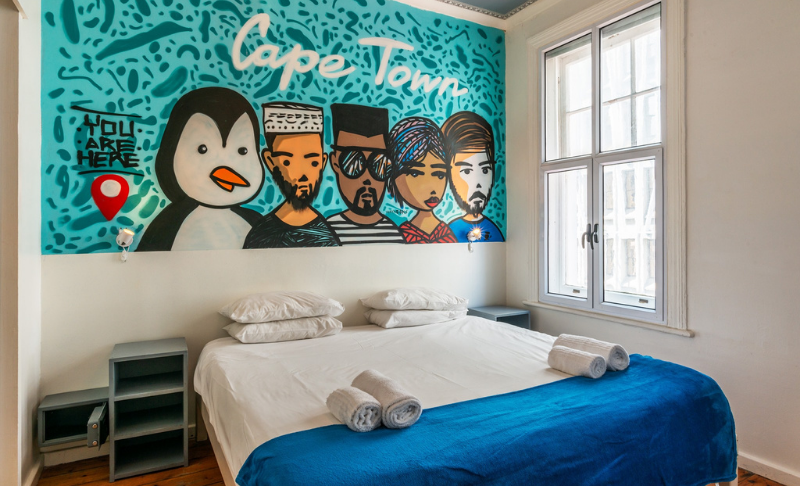
This screenshot has width=800, height=486. In order to click on towel in this screenshot , I will do `click(606, 348)`.